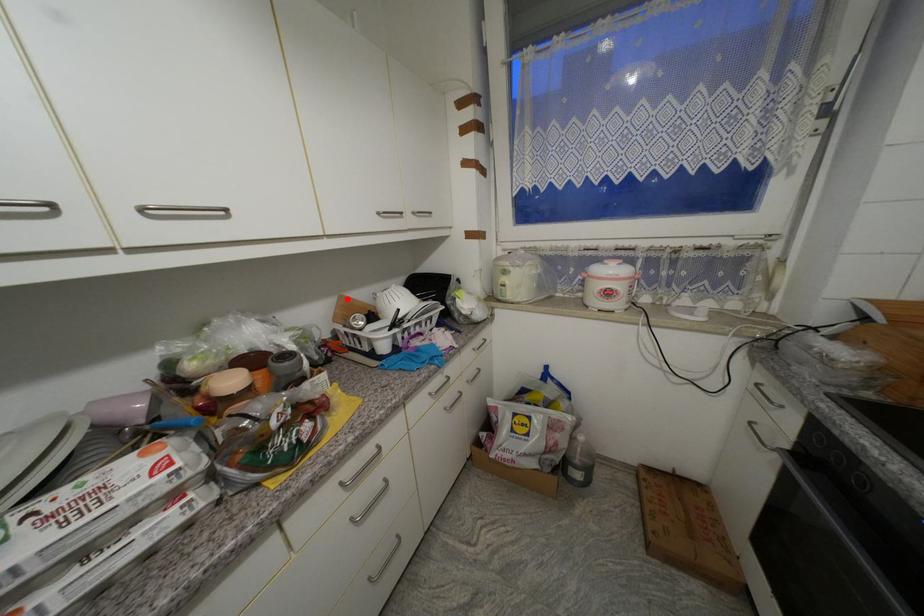
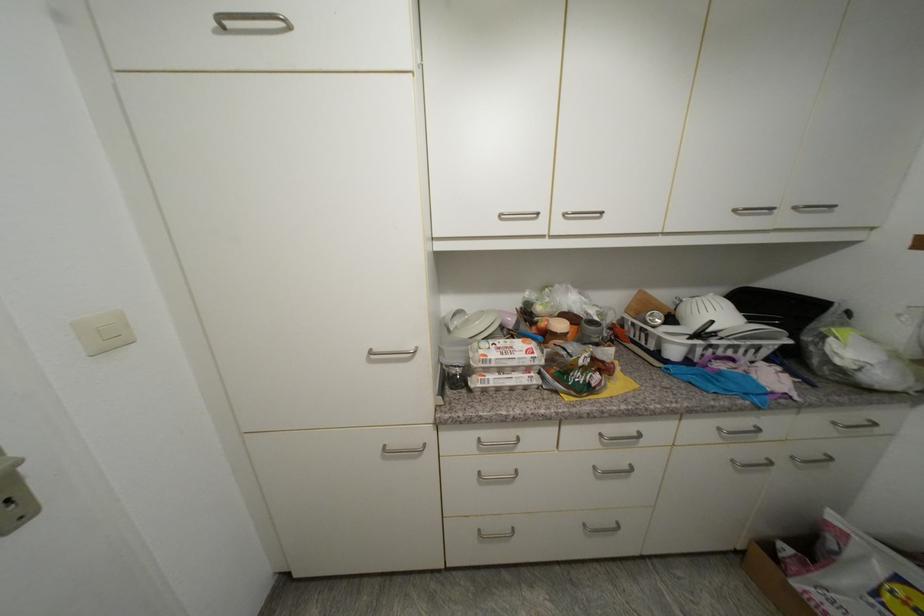
Question: I am providing you with two images of the same scene from different viewpoints. A red point is marked on the first image. At the location where the point appears in image 1, is it still visible in image 2?

Choices:
 (A) Yes
 (B) No

Answer: (A)